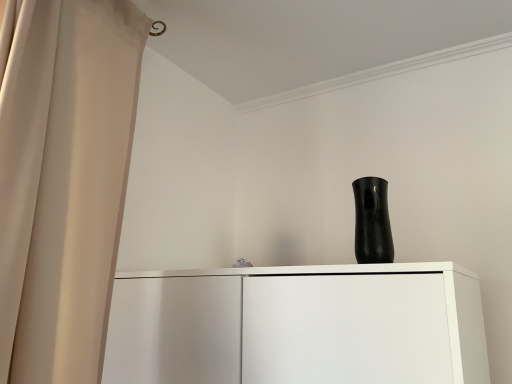
The height and width of the screenshot is (384, 512). Identify the location of beige fabric curtain at left. (63, 179).

Describe the element at coordinates (63, 179) in the screenshot. I see `beige fabric curtain at left` at that location.

Locate an element on the screen. black glossy vase at upper center is located at coordinates (372, 221).

The width and height of the screenshot is (512, 384). What do you see at coordinates (372, 221) in the screenshot? I see `black glossy vase at upper center` at bounding box center [372, 221].

Where is `beige fabric curtain at left`? The width and height of the screenshot is (512, 384). beige fabric curtain at left is located at coordinates (63, 179).

Which object is positioned more to the left, beige fabric curtain at left or black glossy vase at upper center?

From the viewer's perspective, beige fabric curtain at left appears more on the left side.

Based on the photo, is the position of beige fabric curtain at left less distant than that of black glossy vase at upper center?

That is True.

Does point (62, 56) come behind point (360, 241)?

No, it is in front of (360, 241).

From the image's perspective, is beige fabric curtain at left located above black glossy vase at upper center?

Yes.

From a real-world perspective, is beige fabric curtain at left positioned above or below black glossy vase at upper center?

Clearly, from a real-world perspective, beige fabric curtain at left is above black glossy vase at upper center.

Does beige fabric curtain at left have a greater width compared to black glossy vase at upper center?

Correct, the width of beige fabric curtain at left exceeds that of black glossy vase at upper center.

Based on the photo, considering the relative sizes of beige fabric curtain at left and black glossy vase at upper center in the image provided, is beige fabric curtain at left taller than black glossy vase at upper center?

Yes, beige fabric curtain at left is taller than black glossy vase at upper center.

Between beige fabric curtain at left and black glossy vase at upper center, which one has smaller size?

Smaller between the two is black glossy vase at upper center.

Is black glossy vase at upper center located within beige fabric curtain at left?

Actually, black glossy vase at upper center is outside beige fabric curtain at left.

Is beige fabric curtain at left positioned far away from black glossy vase at upper center?

That's not correct — beige fabric curtain at left is a little close to black glossy vase at upper center.

Is beige fabric curtain at left oriented away from black glossy vase at upper center?

That's not correct — beige fabric curtain at left is not looking away from black glossy vase at upper center.

What's the angular difference between beige fabric curtain at left and black glossy vase at upper center's facing directions?

There is a 90-degree angle between the facing directions of beige fabric curtain at left and black glossy vase at upper center.

Where is `vase beneath the beige fabric curtain at left (from a real-world perspective)`? Image resolution: width=512 pixels, height=384 pixels. vase beneath the beige fabric curtain at left (from a real-world perspective) is located at coordinates (372, 221).

Based on their positions, is black glossy vase at upper center located to the left or right of beige fabric curtain at left?

black glossy vase at upper center is positioned on beige fabric curtain at left's right side.

Considering the positions of objects black glossy vase at upper center and beige fabric curtain at left in the image provided, who is in front, black glossy vase at upper center or beige fabric curtain at left?

beige fabric curtain at left is more forward.

Is point (381, 211) closer or farther from the camera than point (65, 248)?

Point (381, 211) is positioned farther from the camera compared to point (65, 248).

From the image's perspective, who appears lower, black glossy vase at upper center or beige fabric curtain at left?

From the image's view, black glossy vase at upper center is below.

From a real-world perspective, between black glossy vase at upper center and beige fabric curtain at left, who is vertically lower?

black glossy vase at upper center is physically lower.

Considering the relative sizes of black glossy vase at upper center and beige fabric curtain at left in the image provided, is black glossy vase at upper center thinner than beige fabric curtain at left?

Yes, black glossy vase at upper center is thinner than beige fabric curtain at left.

Is black glossy vase at upper center taller or shorter than beige fabric curtain at left?

In the image, black glossy vase at upper center appears to be shorter than beige fabric curtain at left.

Does black glossy vase at upper center have a smaller size compared to beige fabric curtain at left?

Correct, black glossy vase at upper center occupies less space than beige fabric curtain at left.

Is black glossy vase at upper center inside the boundaries of beige fabric curtain at left, or outside?

black glossy vase at upper center is not inside beige fabric curtain at left, it's outside.

Consider the image. Is black glossy vase at upper center directly adjacent to beige fabric curtain at left?

No, black glossy vase at upper center is not next to beige fabric curtain at left.

Does black glossy vase at upper center turn towards beige fabric curtain at left?

No, black glossy vase at upper center is not facing towards beige fabric curtain at left.

Can you tell me how much black glossy vase at upper center and beige fabric curtain at left differ in facing direction?

There is a 90-degree angle between the facing directions of black glossy vase at upper center and beige fabric curtain at left.

I want to click on curtain above the black glossy vase at upper center (from a real-world perspective), so click(x=63, y=179).

Where is `curtain above the black glossy vase at upper center (from the image's perspective)`? This screenshot has width=512, height=384. curtain above the black glossy vase at upper center (from the image's perspective) is located at coordinates (63, 179).

This screenshot has height=384, width=512. Find the location of `vase on the right side of beige fabric curtain at left`. vase on the right side of beige fabric curtain at left is located at coordinates (372, 221).